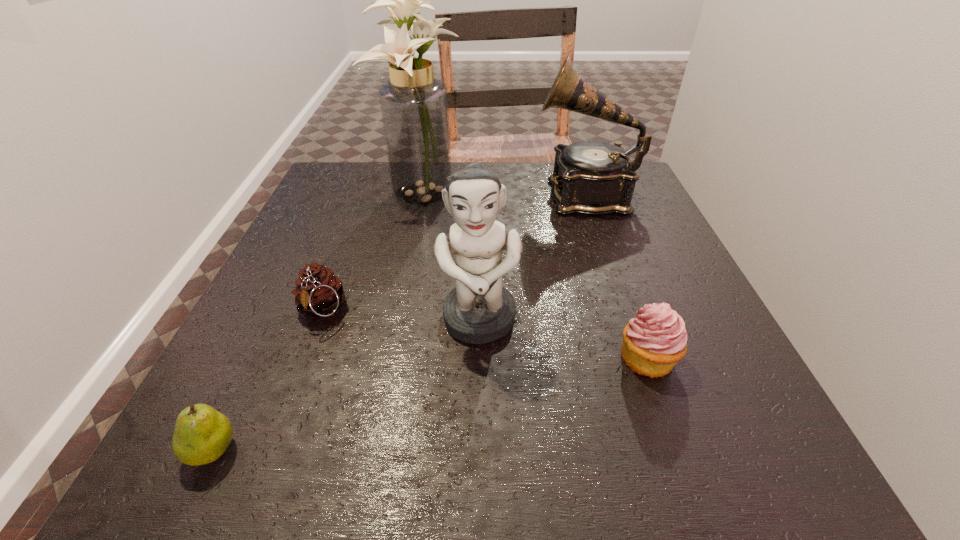
You are a GUI agent. You are given a task and a screenshot of the screen. Output one action in this format:
    pyautogui.click(x=<x>, y=<y>)
    Task: Click on the tallest object
    The width and height of the screenshot is (960, 540).
    Given the screenshot: What is the action you would take?
    point(414,107)

At what (x,y) coordinates should I click in order to perform the action: click on phonograph record. Please return your answer as a coordinate pair (x, y). Looking at the image, I should click on 590,177.

Locate an element on the screen. The width and height of the screenshot is (960, 540). figurine is located at coordinates (479, 310).

Identify the location of cupcake. Image resolution: width=960 pixels, height=540 pixels. (655, 340).

Where is `pinecone`? This screenshot has height=540, width=960. pinecone is located at coordinates (319, 292).

Locate an element on the screen. The image size is (960, 540). the nearest object is located at coordinates (202, 434).

Where is `free region located on the right of the tallest object`? free region located on the right of the tallest object is located at coordinates (487, 191).

Where is `vacant point located on the horn of the phonograph record`? vacant point located on the horn of the phonograph record is located at coordinates (494, 194).

What are the coordinates of `free space located on the horn of the phonograph record` in the screenshot? It's located at (450, 194).

Identify the location of vacant region located 0.240m on the horn of the phonograph record. The image size is (960, 540). (438, 194).